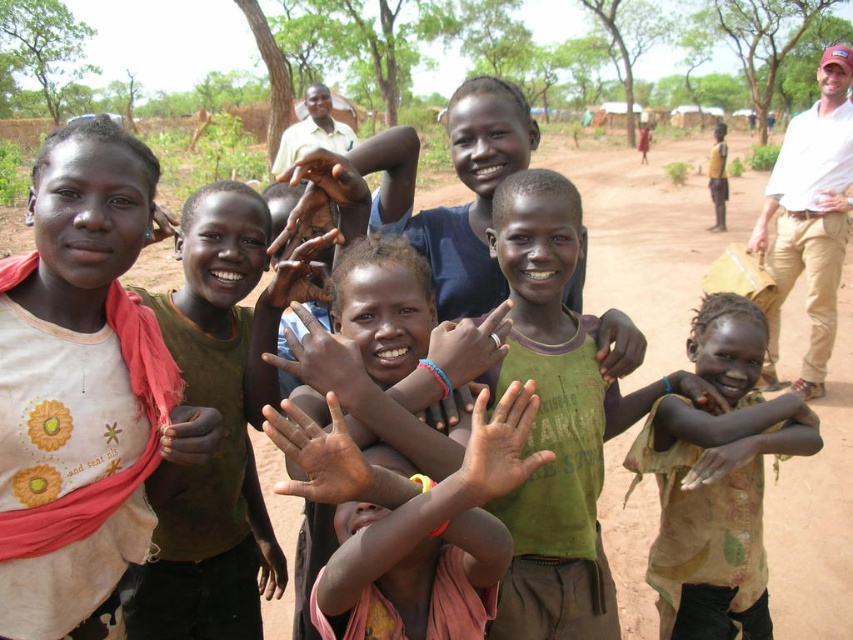
You are a photographer trying to capture a closeup of the matte white shirt at left and the matte green hand at center. Which object should you focus on first to ensure it appears sharp in the photo?

The matte white shirt at left is closer to the viewer than the matte green hand at center, so you should focus on the matte white shirt at left first to ensure it appears sharp.

You are a photographer who wants to ensure that the printed fabric shirt at center and the matte green hand at center are both visible in the photo. Based on their positions, which object is closer to the camera?

The matte green hand at center is closer to the camera because it is positioned above the printed fabric shirt at center, which is below it.

Looking at the two shirts at the center of the image, the green fabric shirt at center and the printed fabric shirt at center, which one is positioned to the left?

The green fabric shirt at center is to the left of the printed fabric shirt at center.